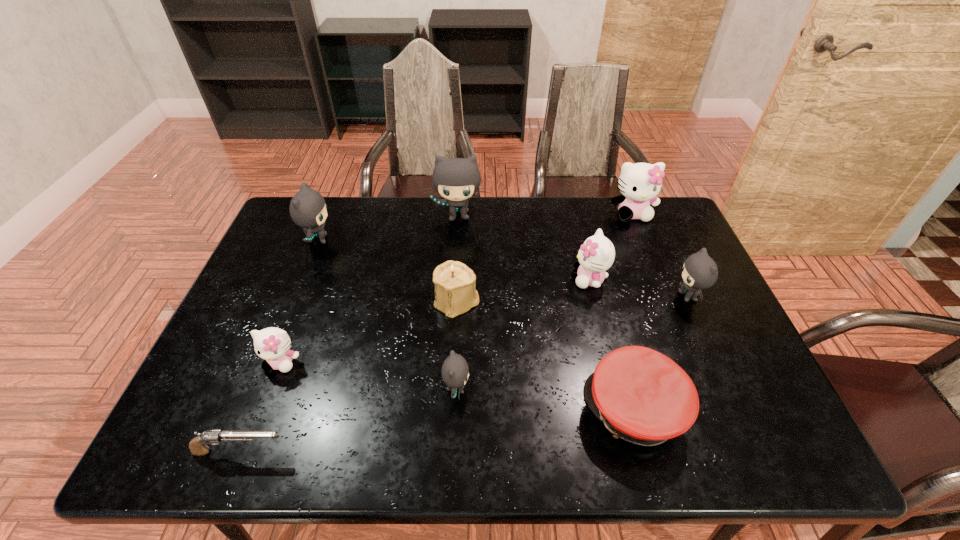
Find the location of `the nearest white kitten`. the nearest white kitten is located at coordinates (273, 344).

Identify the location of the smallest gray kitten. Image resolution: width=960 pixels, height=540 pixels. (455, 371).

I want to click on cap, so click(x=642, y=396).

Where is `gun`? gun is located at coordinates (198, 446).

At what (x,y) coordinates should I click in order to perform the action: click on free space located 0.140m on the front-facing side of the biggest gray kitten. Please return your answer as a coordinate pair (x, y). The height and width of the screenshot is (540, 960). Looking at the image, I should click on (456, 256).

At what (x,y) coordinates should I click in order to perform the action: click on free region located 0.100m on the front-facing side of the farthest white kitten. Please return your answer as a coordinate pair (x, y). The image size is (960, 540). Looking at the image, I should click on (644, 245).

Where is `vacant area situated 0.270m on the front-facing side of the second biggest gray kitten`? This screenshot has height=540, width=960. vacant area situated 0.270m on the front-facing side of the second biggest gray kitten is located at coordinates (420, 240).

Find the location of a particular element. This screenshot has height=540, width=960. free space located 0.060m on the front-facing side of the second smallest white kitten is located at coordinates (552, 279).

The height and width of the screenshot is (540, 960). I want to click on free spot located 0.350m on the front-facing side of the second smallest white kitten, so [452, 279].

At what (x,y) coordinates should I click in order to perform the action: click on vacant space located 0.310m on the front-facing side of the second smallest white kitten. Please return your answer as a coordinate pair (x, y). The image size is (960, 540). Looking at the image, I should click on (466, 279).